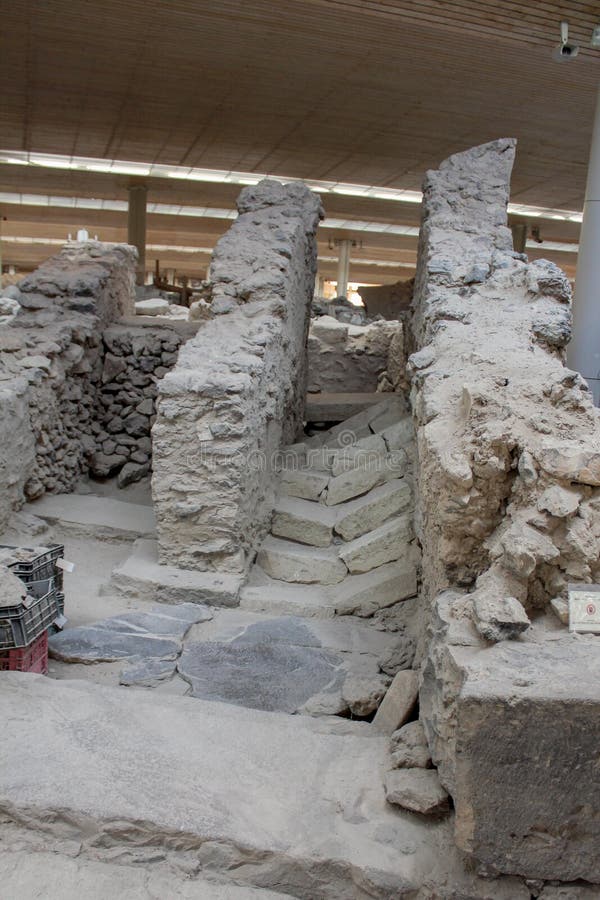
Where is `security camera`? This screenshot has height=900, width=600. security camera is located at coordinates (565, 49).